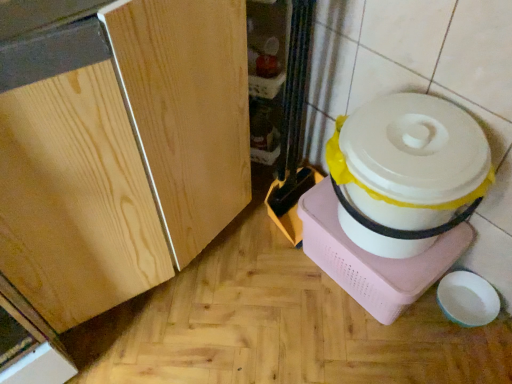
What do you see at coordinates (120, 150) in the screenshot? This screenshot has height=384, width=512. I see `light wood cabinet at center` at bounding box center [120, 150].

The height and width of the screenshot is (384, 512). What are the coordinates of `light wood cabinet at center` in the screenshot? It's located at (120, 150).

What do you see at coordinates (396, 199) in the screenshot? I see `white plastic rice cooker at right` at bounding box center [396, 199].

Identify the location of white plastic rice cooker at right. (396, 199).

At what (x,y) coordinates should I click in order to perform the action: click on light wood cabinet at center. Please return your answer as a coordinate pair (x, y). Image resolution: width=512 pixels, height=384 pixels. Looking at the image, I should click on (120, 150).

Between white plastic rice cooker at right and light wood cabinet at center, which one appears on the right side from the viewer's perspective?

white plastic rice cooker at right.

Considering the positions of objects white plastic rice cooker at right and light wood cabinet at center in the image provided, who is behind, white plastic rice cooker at right or light wood cabinet at center?

white plastic rice cooker at right.

Between point (431, 116) and point (173, 247), which one is positioned in front?

The point (431, 116) is closer.

From the image's perspective, is white plastic rice cooker at right positioned above or below light wood cabinet at center?

Based on their image positions, white plastic rice cooker at right is located beneath light wood cabinet at center.

From a real-world perspective, relative to light wood cabinet at center, is white plastic rice cooker at right vertically above or below?

white plastic rice cooker at right is situated lower than light wood cabinet at center in the real world.

Is white plastic rice cooker at right thinner than light wood cabinet at center?

Correct, the width of white plastic rice cooker at right is less than that of light wood cabinet at center.

Which of these two, white plastic rice cooker at right or light wood cabinet at center, stands shorter?

Standing shorter between the two is white plastic rice cooker at right.

Between white plastic rice cooker at right and light wood cabinet at center, which one has larger size?

light wood cabinet at center.

Can light wood cabinet at center be found inside white plastic rice cooker at right?

No.

Are white plastic rice cooker at right and light wood cabinet at center making contact?

They are not placed beside each other.

Is white plastic rice cooker at right positioned with its back to light wood cabinet at center?

No, white plastic rice cooker at right's orientation is not away from light wood cabinet at center.

How different are the orientations of white plastic rice cooker at right and light wood cabinet at center in degrees?

90.5 degrees.

You are a GUI agent. You are given a task and a screenshot of the screen. Output one action in this format:
    pyautogui.click(x=<x>, y=<y>)
    Task: Click on the cabinetry located above the white plastic rice cooker at right (from the image's perspective)
    The width and height of the screenshot is (512, 384).
    Given the screenshot: What is the action you would take?
    pyautogui.click(x=120, y=150)

In the image, is light wood cabinet at center on the left side or the right side of white plastic rice cooker at right?

From the image, it's evident that light wood cabinet at center is to the left of white plastic rice cooker at right.

From the picture: Is light wood cabinet at center further to camera compared to white plastic rice cooker at right?

No, light wood cabinet at center is in front of white plastic rice cooker at right.

Considering the positions of points (126, 179) and (368, 188), is point (126, 179) closer to camera compared to point (368, 188)?

Yes, point (126, 179) is in front of point (368, 188).

From the image's perspective, which one is positioned higher, light wood cabinet at center or white plastic rice cooker at right?

light wood cabinet at center appears higher in the image.

From a real-world perspective, is light wood cabinet at center above or below white plastic rice cooker at right?

Clearly, from a real-world perspective, light wood cabinet at center is above white plastic rice cooker at right.

Between light wood cabinet at center and white plastic rice cooker at right, which one has smaller width?

With smaller width is white plastic rice cooker at right.

From their relative heights in the image, would you say light wood cabinet at center is taller or shorter than white plastic rice cooker at right?

Clearly, light wood cabinet at center is taller compared to white plastic rice cooker at right.

Who is smaller, light wood cabinet at center or white plastic rice cooker at right?

With smaller size is white plastic rice cooker at right.

Is light wood cabinet at center spatially inside white plastic rice cooker at right, or outside of it?

light wood cabinet at center is located beyond the bounds of white plastic rice cooker at right.

Is light wood cabinet at center with white plastic rice cooker at right?

No, light wood cabinet at center is not next to white plastic rice cooker at right.

Could you tell me if light wood cabinet at center is facing white plastic rice cooker at right?

Yes, light wood cabinet at center faces towards white plastic rice cooker at right.

In the scene shown: What's the angular difference between light wood cabinet at center and white plastic rice cooker at right's facing directions?

There is a 90.5-degree angle between the facing directions of light wood cabinet at center and white plastic rice cooker at right.

How distant is light wood cabinet at center from white plastic rice cooker at right?

light wood cabinet at center and white plastic rice cooker at right are 15.69 inches apart from each other.

Identify the location of cabinetry above the white plastic rice cooker at right (from the image's perspective). (120, 150).

Locate an element on the screen. This screenshot has height=384, width=512. appliance that appears behind the light wood cabinet at center is located at coordinates (396, 199).

Identify the location of cabinetry on the left of white plastic rice cooker at right. This screenshot has width=512, height=384. (120, 150).